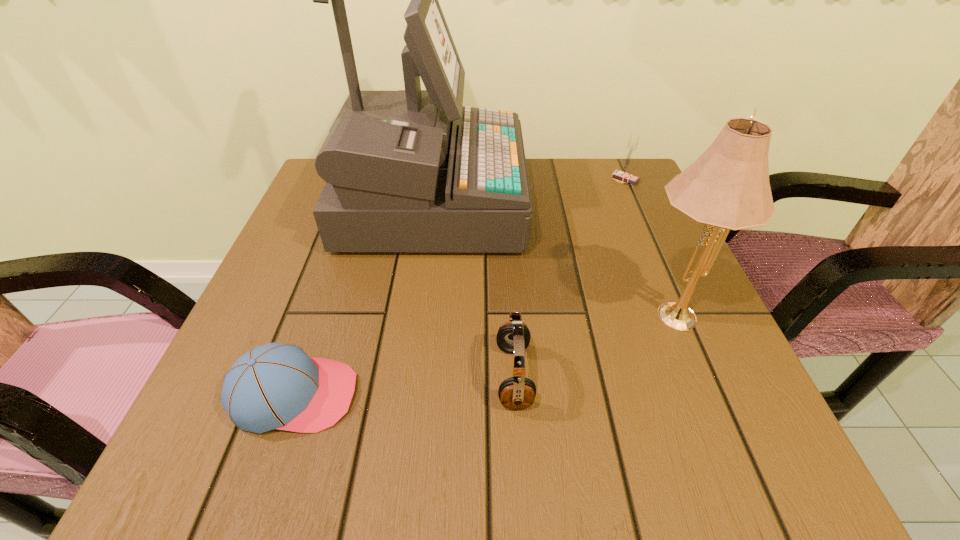
This screenshot has width=960, height=540. I want to click on cash register, so click(x=412, y=170).

At what (x,y) coordinates should I click in order to perform the action: click on the fourth shortest object. Please return your answer as a coordinate pair (x, y). The height and width of the screenshot is (540, 960). Looking at the image, I should click on (728, 187).

Identify the location of matchbox. (623, 174).

You are a GUI agent. You are given a task and a screenshot of the screen. Output one action in this format:
    pyautogui.click(x=<x>, y=<y>)
    Task: Click on the headset
    This screenshot has height=540, width=960.
    Given the screenshot: What is the action you would take?
    pyautogui.click(x=518, y=392)

Image resolution: width=960 pixels, height=540 pixels. I want to click on baseball cap, so (278, 386).

I want to click on vacant space located 0.320m on the customer-facing side of the cash register, so click(655, 201).

Locate an element on the screen. This screenshot has width=960, height=540. vacant position located on the front of the second tallest object is located at coordinates (725, 446).

You are a GUI agent. You are given a task and a screenshot of the screen. Output one action in this format:
    pyautogui.click(x=<x>, y=<y>)
    Task: Click on the free space located on the left of the matchbox
    
    Given the screenshot: What is the action you would take?
    pyautogui.click(x=523, y=179)

At what (x,y) coordinates should I click in order to perform the action: click on vacant space situated 0.190m on the ear cups of the headset. Please return your answer as a coordinate pair (x, y). The height and width of the screenshot is (540, 960). Looking at the image, I should click on (379, 376).

The height and width of the screenshot is (540, 960). I want to click on vacant area located on the ear cups of the headset, so click(275, 376).